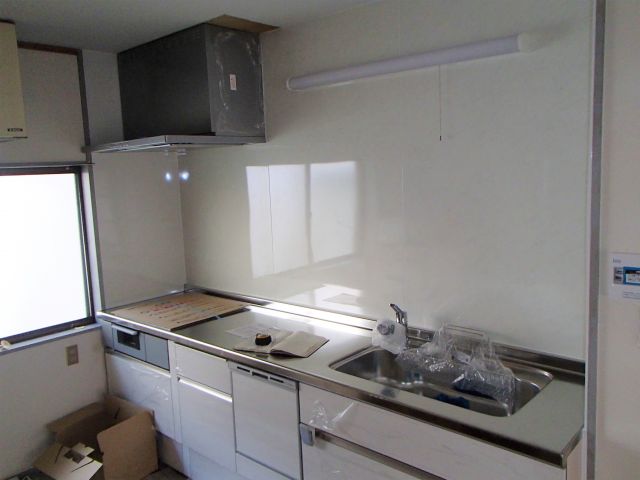
Identify the location of lights. The image size is (640, 480). (166, 178), (185, 177), (467, 54).